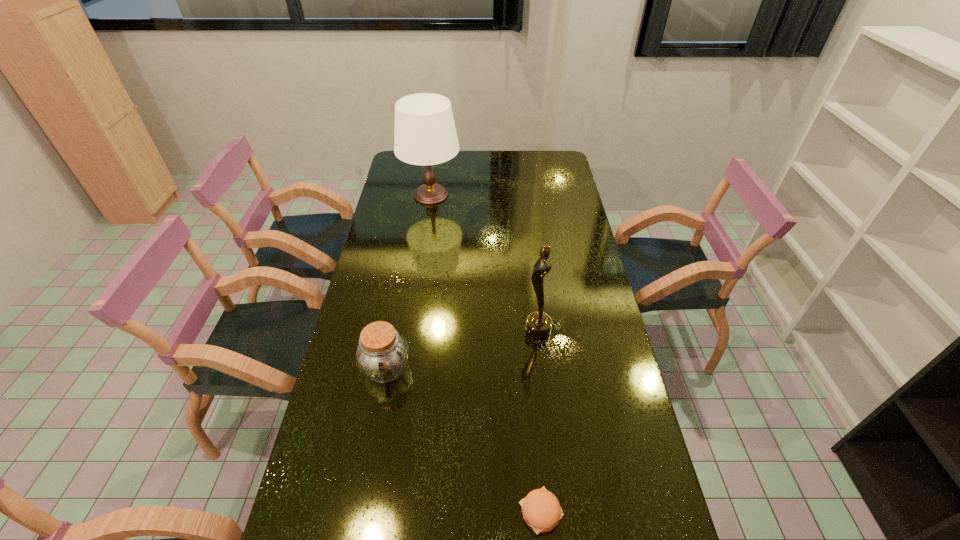
The image size is (960, 540). In order to click on object that stands as the closest to the tallest object in this screenshot , I will do `click(538, 324)`.

The height and width of the screenshot is (540, 960). Identify the location of vacant space that satisfies the following two spatial constraints: 1. on the front side of the nearest object; 2. on the left side of the jar. (360, 511).